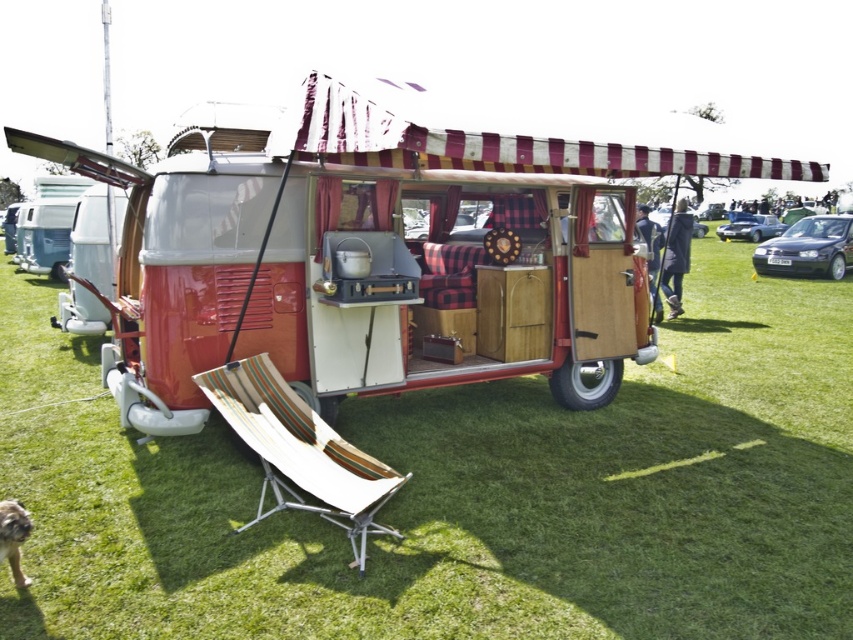
You are standing in the grassy field and see the matte red camper van at center and the dark blue metallic sedan at right. Which vehicle is positioned closer to the left side of the field?

The matte red camper van at center is positioned to the left of the dark blue metallic sedan at right, so it is closer to the left side of the field.

You are planning to park your vehicle next to the matte red camper van at center and the dark blue metallic sedan at right. Which vehicle should you avoid parking too close to if you want to leave first?

You should avoid parking too close to the matte red camper van at center because it is wider than the dark blue metallic sedan at right, requiring more space to maneuver when leaving.

You are a person sitting in the beige fabric chair at lower center. You want to get into the dark blue metallic sedan at right. Is the sedan blocking your path to exit the chair?

The beige fabric chair at lower center is positioned under the dark blue metallic sedan at right, so the sedan is blocking your path to exit the chair.